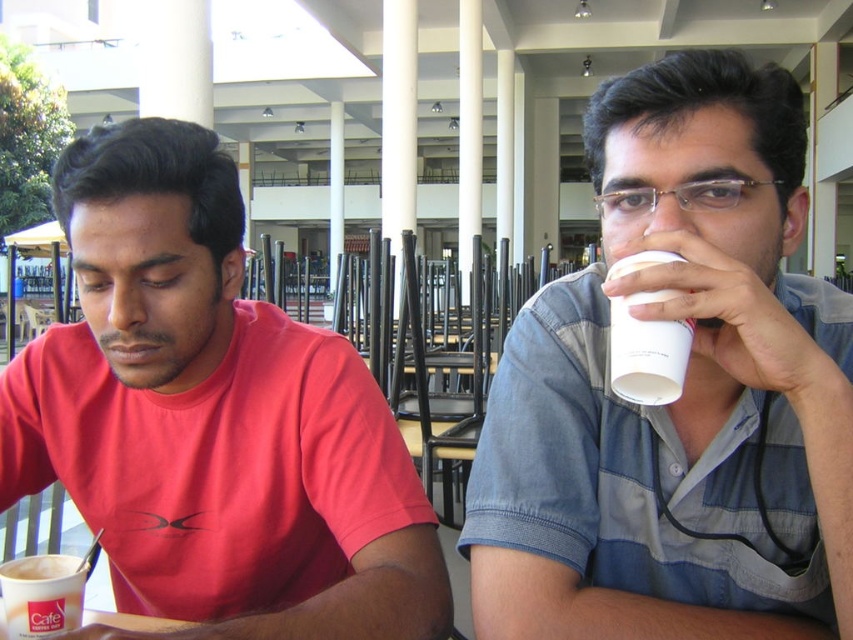
Question: Which point is farther to the camera?

Choices:
 (A) matte red shirt at center
 (B) white frothy coffee cup at lower left
 (C) white paper cup at upper right

Answer: (B)

Question: Among these objects, which one is farthest from the camera?

Choices:
 (A) white frothy coffee cup at lower left
 (B) white paper cup at upper center
 (C) white paper cup at upper right

Answer: (A)

Question: Which of these objects is positioned farthest from the matte red shirt at center?

Choices:
 (A) white frothy coffee cup at lower left
 (B) white matte cup at lower left

Answer: (A)

Question: Can you confirm if matte red shirt at center is positioned above white frothy coffee cup at lower left?

Choices:
 (A) no
 (B) yes

Answer: (B)

Question: Can you confirm if white frothy coffee cup at lower left is bigger than white matte cup at lower left?

Choices:
 (A) yes
 (B) no

Answer: (A)

Question: Is matte red shirt at center bigger than white frothy coffee cup at lower left?

Choices:
 (A) yes
 (B) no

Answer: (A)